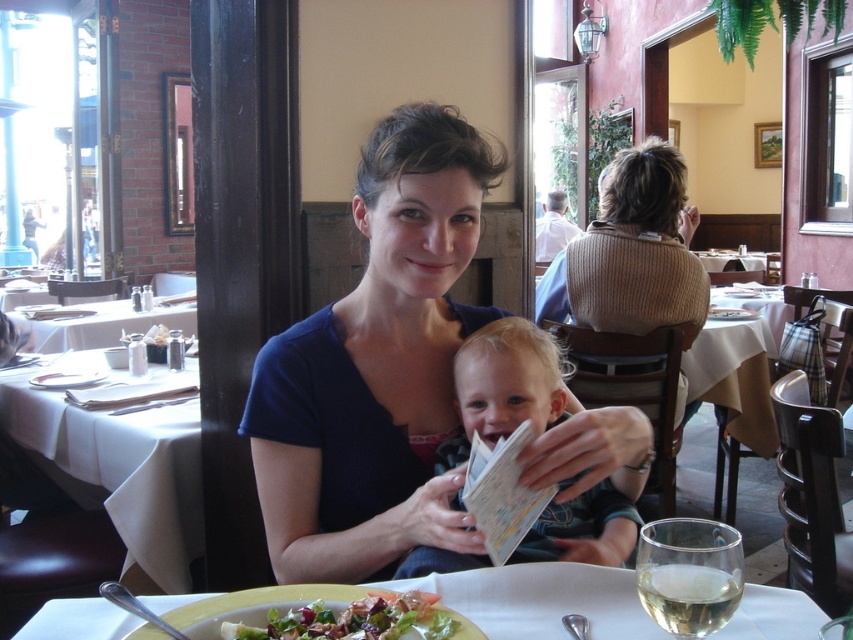
Does matte blue shirt at center come behind white ceramic plate at lower center?

That is True.

Image resolution: width=853 pixels, height=640 pixels. What do you see at coordinates (376, 368) in the screenshot?
I see `matte blue shirt at center` at bounding box center [376, 368].

Locate an element on the screen. This screenshot has height=640, width=853. matte blue shirt at center is located at coordinates (376, 368).

Between point (817, 621) and point (431, 628), which one is positioned behind?

The point (817, 621) is more distant.

Between point (107, 636) and point (444, 627), which one is positioned behind?

The point (107, 636) is more distant.

This screenshot has width=853, height=640. Identify the location of white ceramic plate at lower center. (543, 600).

Is point (294, 330) positioned in front of point (165, 554)?

Yes, it is.

Locate an element on the screen. matte blue shirt at center is located at coordinates (376, 368).